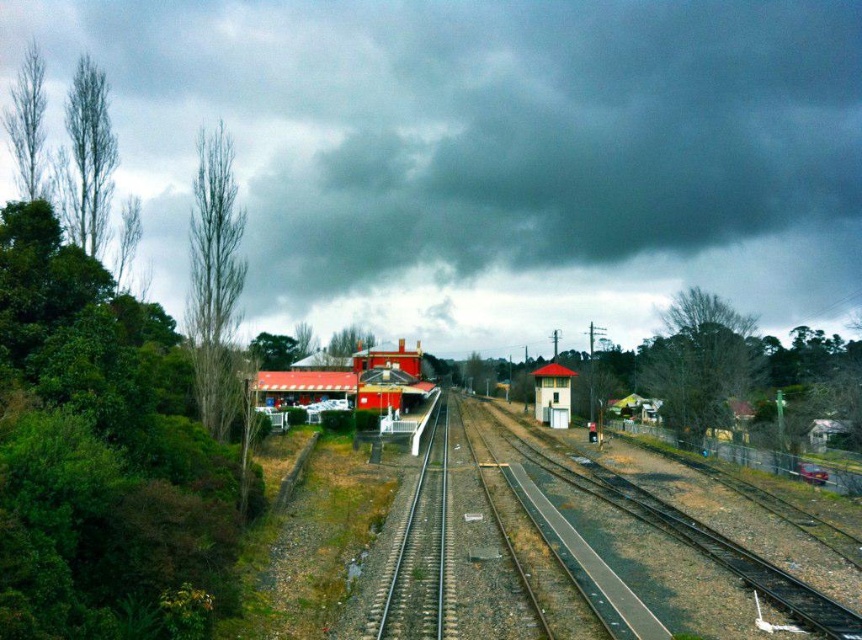
Can you confirm if matte brick building at center is taller than white plastic building at center?

Indeed, matte brick building at center has a greater height compared to white plastic building at center.

Does matte brick building at center have a lesser width compared to white plastic building at center?

No.

Which is in front, point (413, 372) or point (569, 397)?

Positioned in front is point (569, 397).

You are a GUI agent. You are given a task and a screenshot of the screen. Output one action in this format:
    pyautogui.click(x=<x>, y=<y>)
    Task: Click on the matte brick building at center
    Image resolution: width=862 pixels, height=640 pixels.
    Given the screenshot: What is the action you would take?
    pyautogui.click(x=358, y=387)

Is green asphalt track at center bigger than matte brick building at center?

Incorrect, green asphalt track at center is not larger than matte brick building at center.

Does green asphalt track at center have a greater height compared to matte brick building at center?

In fact, green asphalt track at center may be shorter than matte brick building at center.

You are a GUI agent. You are given a task and a screenshot of the screen. Output one action in this format:
    pyautogui.click(x=<x>, y=<y>)
    Task: Click on the green asphalt track at center
    This screenshot has height=640, width=862.
    Given the screenshot: What is the action you would take?
    pyautogui.click(x=554, y=545)

Which is more to the right, dark gray cloud at upper center or white plastic building at center?

white plastic building at center is more to the right.

Is dark gray cloud at upper center thinner than white plastic building at center?

No.

You are a GUI agent. You are given a task and a screenshot of the screen. Output one action in this format:
    pyautogui.click(x=<x>, y=<y>)
    Task: Click on the dark gray cloud at upper center
    The width and height of the screenshot is (862, 640).
    Given the screenshot: What is the action you would take?
    pyautogui.click(x=489, y=154)

I want to click on dark gray cloud at upper center, so click(489, 154).